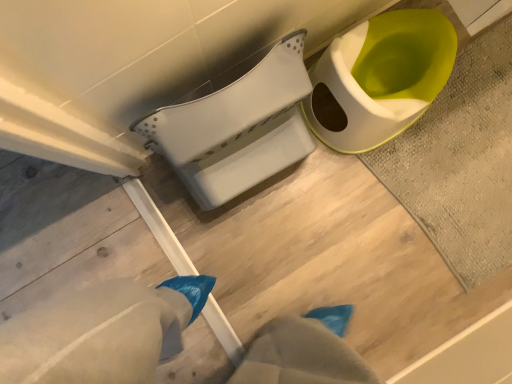
Question: Is matte white toilet at upper right, which is counted as the 1th toilet, starting from the right, to the left or to the right of textured gray bath mat at upper right in the image?

Choices:
 (A) left
 (B) right

Answer: (A)

Question: Considering the positions of point [441, 31] and point [501, 228], is point [441, 31] closer or farther from the camera than point [501, 228]?

Choices:
 (A) closer
 (B) farther

Answer: (A)

Question: Which object is the farthest from the matte white toilet at upper right, which is counted as the 1th toilet, starting from the right?

Choices:
 (A) textured gray bath mat at upper right
 (B) white plastic toilet at center, arranged as the 1th toilet when viewed from the left

Answer: (B)

Question: Based on their relative distances, which object is nearer to the matte white toilet at upper right, which is counted as the 1th toilet, starting from the right?

Choices:
 (A) textured gray bath mat at upper right
 (B) white plastic toilet at center, arranged as the 1th toilet when viewed from the left

Answer: (A)